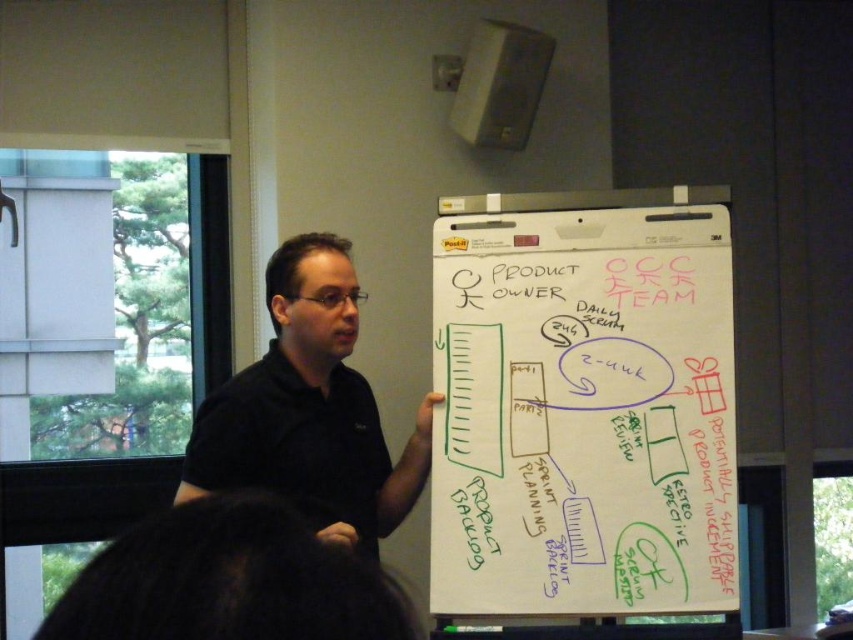
Between whiteboard at center and black shirt at center, which one appears on the right side from the viewer's perspective?

From the viewer's perspective, whiteboard at center appears more on the right side.

Does whiteboard at center have a larger size compared to black shirt at center?

Incorrect, whiteboard at center is not larger than black shirt at center.

Where is `whiteboard at center`? whiteboard at center is located at coordinates (582, 410).

At what (x,y) coordinates should I click in order to perform the action: click on whiteboard at center. Please return your answer as a coordinate pair (x, y). The height and width of the screenshot is (640, 853). Looking at the image, I should click on (582, 410).